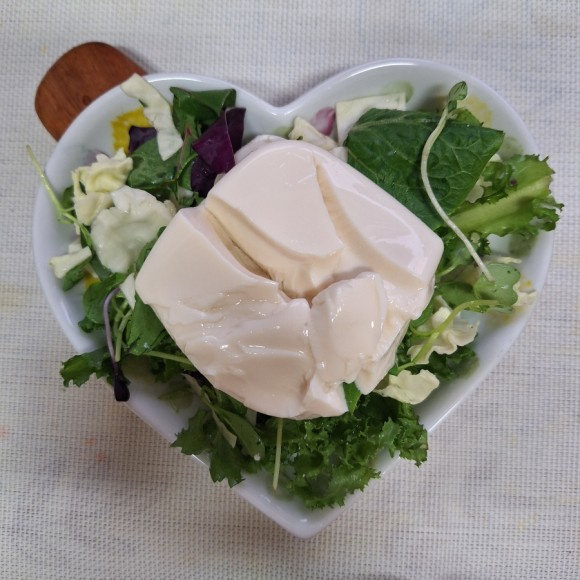
Image resolution: width=580 pixels, height=580 pixels. Find the location of `wooden spoon`. wooden spoon is located at coordinates (71, 82).